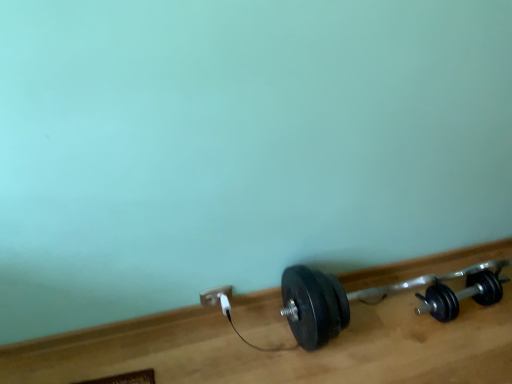
Question: Does black rubber dumbbell at lower right, the first dumbbell viewed from the right, have a greater height compared to white plastic plug at lower center?

Choices:
 (A) no
 (B) yes

Answer: (B)

Question: From the image's perspective, is black rubber dumbbell at lower right, the first dumbbell viewed from the right, over white plastic plug at lower center?

Choices:
 (A) yes
 (B) no

Answer: (A)

Question: Is black rubber dumbbell at lower right, the 2th dumbbell positioned from the left, aimed at white plastic plug at lower center?

Choices:
 (A) yes
 (B) no

Answer: (B)

Question: Is black rubber dumbbell at lower right, the 2th dumbbell positioned from the left, at the left side of white plastic plug at lower center?

Choices:
 (A) yes
 (B) no

Answer: (B)

Question: Can you confirm if black rubber dumbbell at lower right, the 2th dumbbell positioned from the left, is smaller than white plastic plug at lower center?

Choices:
 (A) yes
 (B) no

Answer: (B)

Question: From a real-world perspective, is black rubber dumbbell at lower right, the 2th dumbbell positioned from the left, below white plastic plug at lower center?

Choices:
 (A) no
 (B) yes

Answer: (B)

Question: Is white plastic power plug at lower center wider than black rubber dumbbell at lower right, the first dumbbell viewed from the right?

Choices:
 (A) yes
 (B) no

Answer: (B)

Question: Is white plastic power plug at lower center outside of black rubber dumbbell at lower right, the first dumbbell viewed from the right?

Choices:
 (A) yes
 (B) no

Answer: (A)

Question: Is black rubber dumbbell at lower right, the 2th dumbbell positioned from the left, a part of white plastic power plug at lower center?

Choices:
 (A) yes
 (B) no

Answer: (B)

Question: Considering the relative sizes of white plastic power plug at lower center and black rubber dumbbell at lower right, the 2th dumbbell positioned from the left, in the image provided, is white plastic power plug at lower center taller than black rubber dumbbell at lower right, the 2th dumbbell positioned from the left,?

Choices:
 (A) no
 (B) yes

Answer: (A)

Question: Are white plastic power plug at lower center and black rubber dumbbell at lower right, the 2th dumbbell positioned from the left, beside each other?

Choices:
 (A) yes
 (B) no

Answer: (B)

Question: Is white plastic power plug at lower center aimed at black rubber dumbbell at lower right, the first dumbbell viewed from the right?

Choices:
 (A) no
 (B) yes

Answer: (A)

Question: Could you tell me if white plastic plug at lower center is facing black rubber dumbbell at lower right, the 2th dumbbell positioned from the left?

Choices:
 (A) no
 (B) yes

Answer: (A)